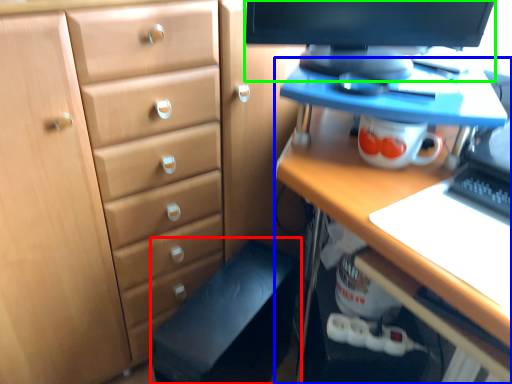
Question: Which object is positioned farthest from computer chair (highlighted by a red box)? Select from desk (highlighted by a blue box) and computer monitor (highlighted by a green box).

Choices:
 (A) desk
 (B) computer monitor

Answer: (B)